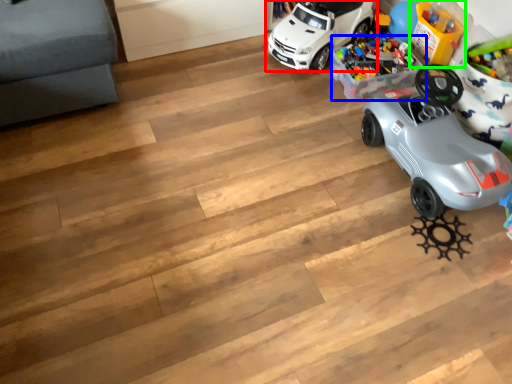
Question: Estimate the real-world distances between objects in this image. Which object is farther from car (highlighted by a red box), toy (highlighted by a blue box) or toy (highlighted by a green box)?

Choices:
 (A) toy
 (B) toy

Answer: (B)